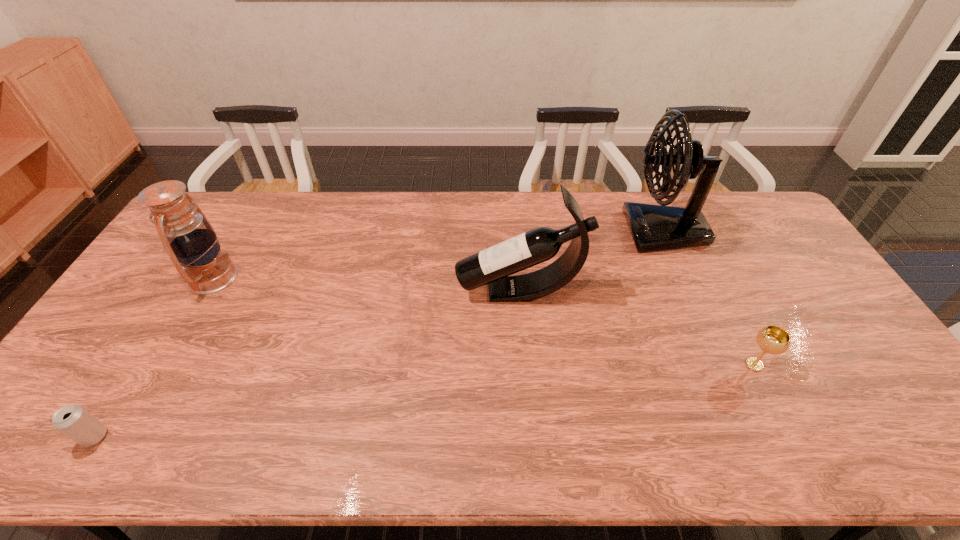
Identify the location of object that is at the near left corner. (76, 423).

In the image, there is a desktop. What are the coordinates of `free space at the far edge` in the screenshot? It's located at (351, 230).

In order to click on vacant space at the right edge of the desktop in this screenshot , I will do `click(772, 239)`.

In the image, there is a desktop. Where is `vacant space at the far right corner`? vacant space at the far right corner is located at coordinates (737, 210).

Identify the location of free space between the beer can and the tallest object. (379, 334).

Locate an element on the screen. This screenshot has height=540, width=960. vacant space that is in between the shortest object and the second shortest object is located at coordinates click(x=424, y=401).

You are a GUI agent. You are given a task and a screenshot of the screen. Output one action in this format:
    pyautogui.click(x=<x>, y=<y>)
    Task: Click on the vacant region between the third object from left to right and the fan
    
    Given the screenshot: What is the action you would take?
    pyautogui.click(x=591, y=261)

Identify the location of free space between the oil lamp and the shortest object. (154, 357).

The image size is (960, 540). I want to click on vacant area that lies between the tallest object and the nearest object, so click(x=379, y=334).

Where is `free space between the fan and the oil lamp`? free space between the fan and the oil lamp is located at coordinates pyautogui.click(x=438, y=254).